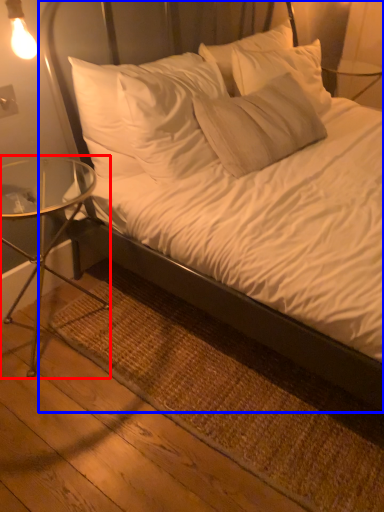
Question: Which of the following is the farthest to the observer, table (highlighted by a red box) or bed (highlighted by a blue box)?

Choices:
 (A) table
 (B) bed

Answer: (A)